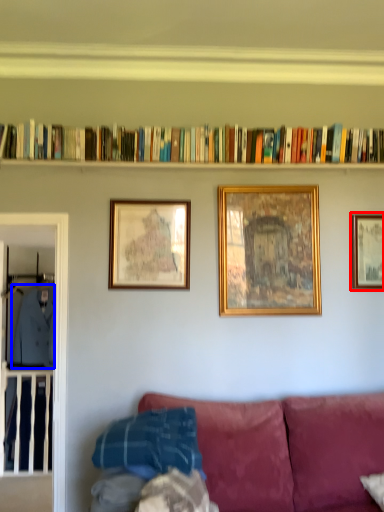
Question: Which of the following is the closest to the observer, picture frame (highlighted by a red box) or clothing (highlighted by a blue box)?

Choices:
 (A) picture frame
 (B) clothing

Answer: (A)